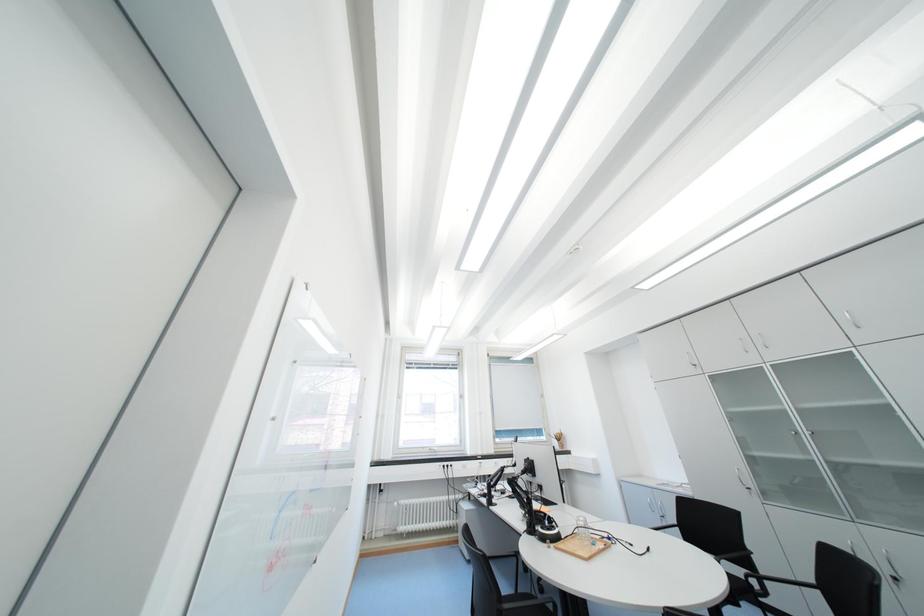
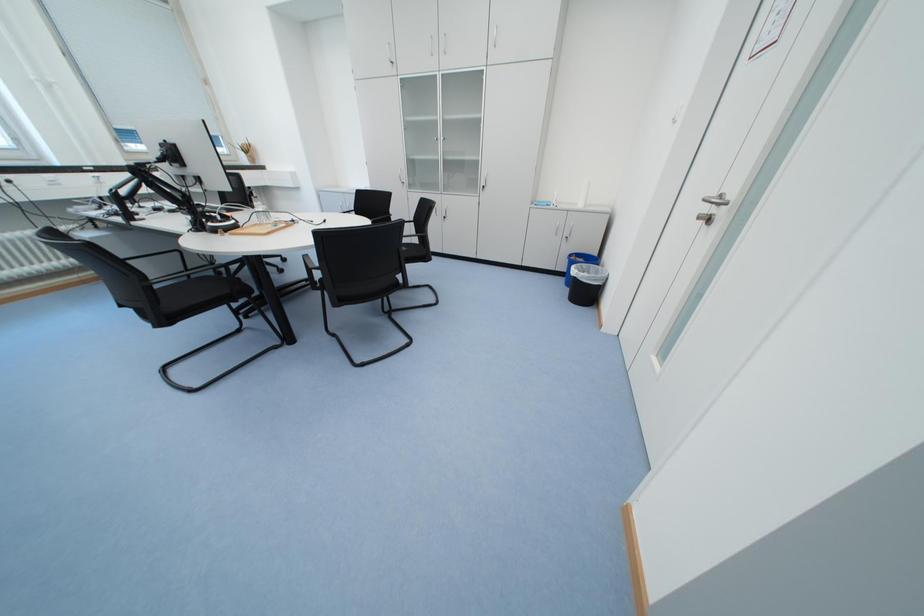
Based on the continuous images, in which direction is the camera rotating?

The rotation direction of the camera is right-down.